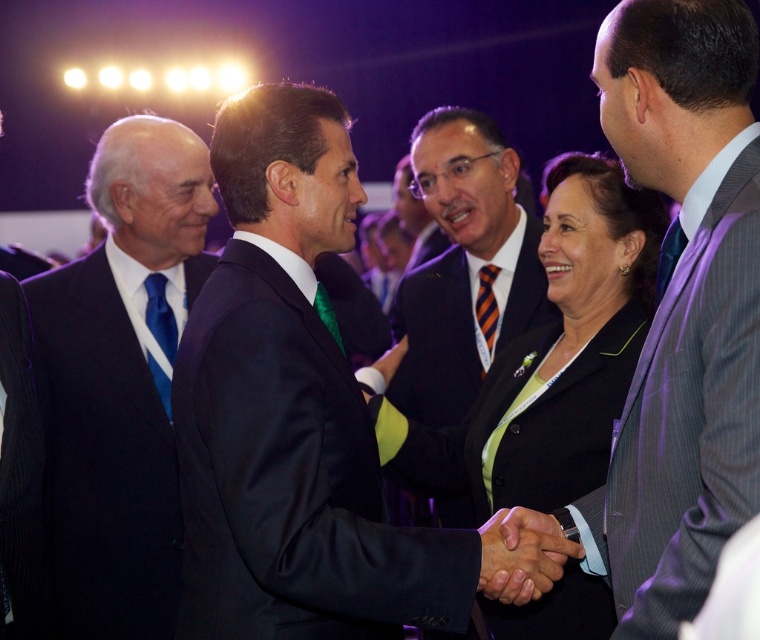
Does black matte blazer at center have a lesser width compared to blue silk tie at center?

No, black matte blazer at center is not thinner than blue silk tie at center.

Does point (583, 320) lie in front of point (168, 404)?

Yes, point (583, 320) is closer to viewer.

Which is behind, point (616, 212) or point (154, 280)?

Point (154, 280)

Locate an element on the screen. black matte blazer at center is located at coordinates (597, 237).

Is navy blue suit at center positioned before black pinstripe suit at left?

Yes, it is in front of black pinstripe suit at left.

Which is below, navy blue suit at center or black pinstripe suit at left?

navy blue suit at center is below.

What do you see at coordinates (290, 480) in the screenshot? I see `navy blue suit at center` at bounding box center [290, 480].

At what (x,y) coordinates should I click in order to perform the action: click on navy blue suit at center. Please return your answer as a coordinate pair (x, y). The image size is (760, 640). Looking at the image, I should click on (290, 480).

In the scene shown: Which is more to the right, blue silk tie at left or black pinstripe suit at left?

blue silk tie at left

What do you see at coordinates (119, 381) in the screenshot? This screenshot has width=760, height=640. I see `blue silk tie at left` at bounding box center [119, 381].

Between point (105, 412) and point (21, 342), which one is positioned in front?

Point (21, 342) is in front.

The image size is (760, 640). Identify the location of blue silk tie at left. (119, 381).